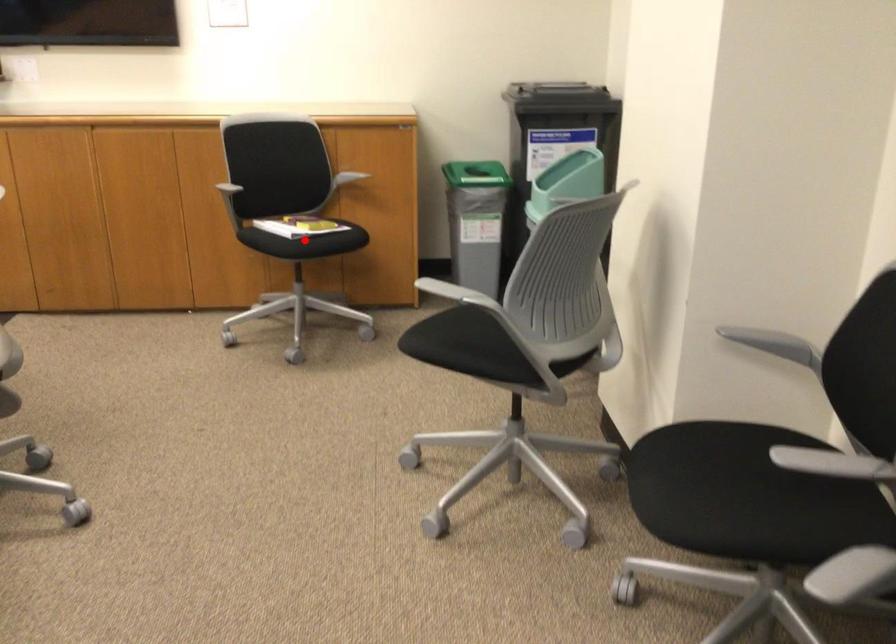
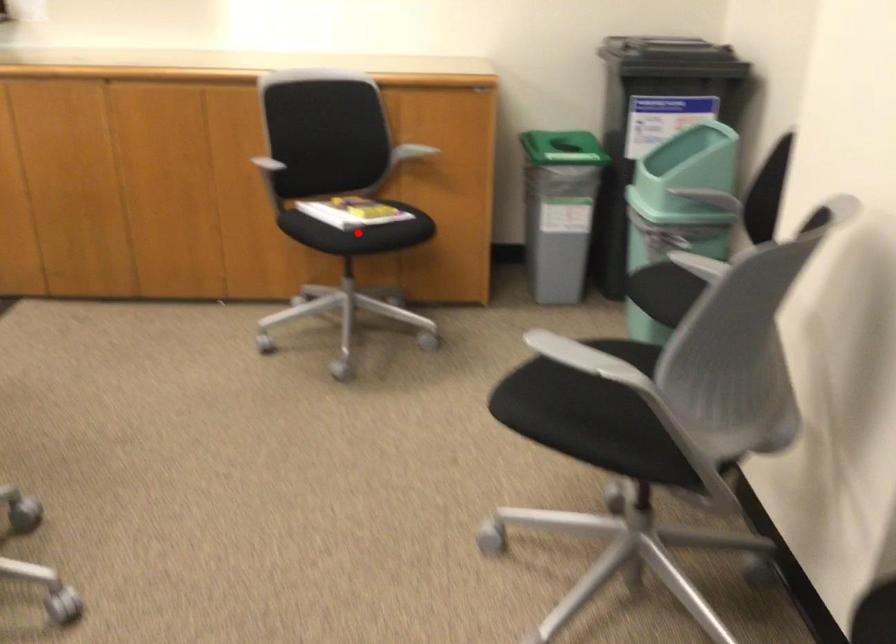
I am providing you with two images of the same scene from different viewpoints. A red point is marked on the first image and another point is marked on the second image. Does the point marked in image1 correspond to the same location as the one in image2?

Yes